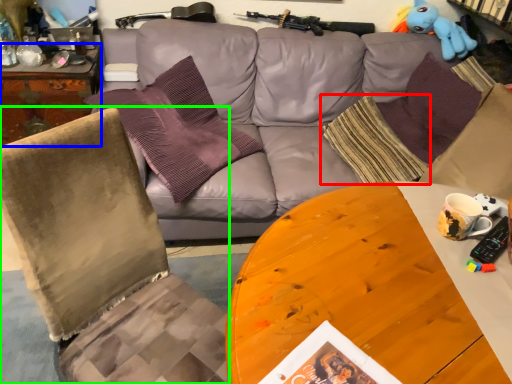
Question: Which object is the closest to the pillow (highlighted by a red box)? Choose among these: desk (highlighted by a blue box) or chair (highlighted by a green box).

Choices:
 (A) desk
 (B) chair

Answer: (B)